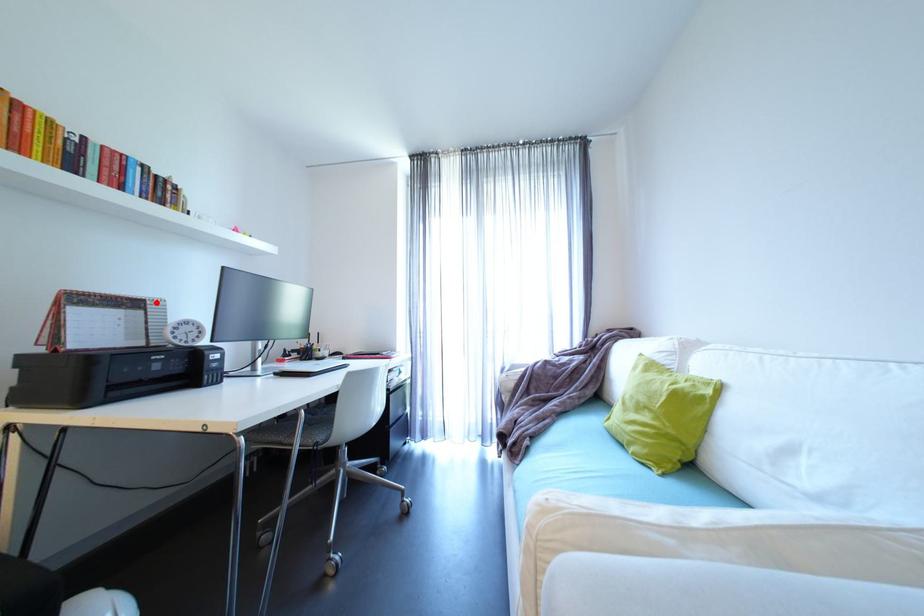
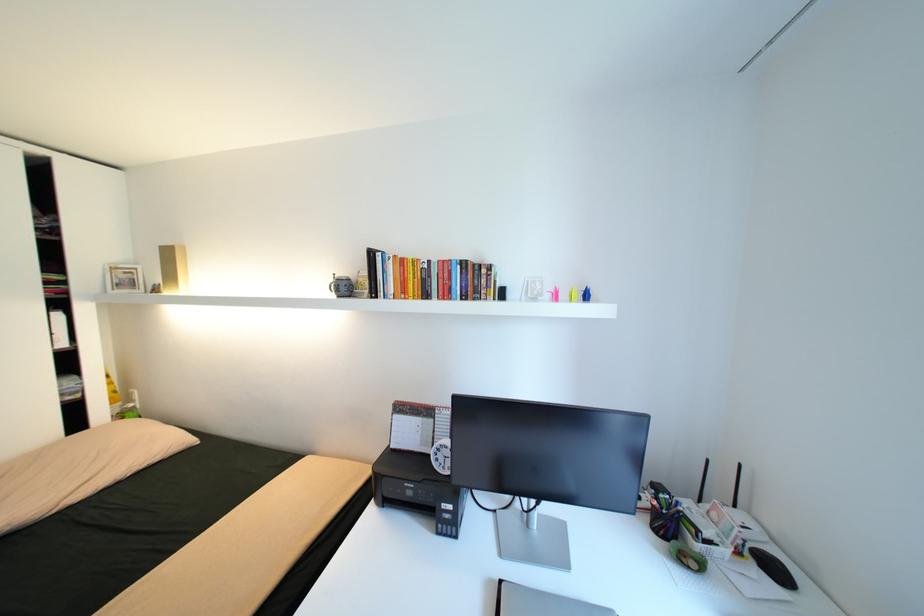
Question: I am providing you with two images of the same scene from different viewpoints. Image1 has a red point marked. In image2, the corresponding 3D location appears at what relative position? Reply with the corresponding letter.

Choices:
 (A) Closer
 (B) Farther

Answer: (B)